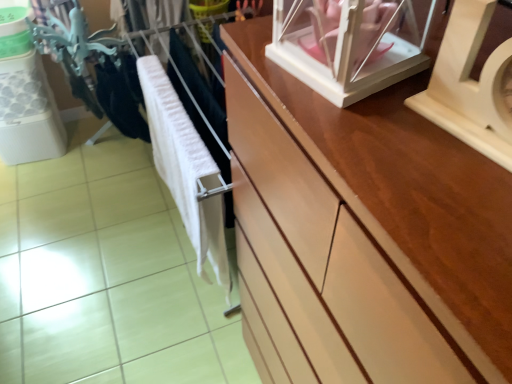
Question: Is white soft cloth at center oriented away from wooden clock at upper right?

Choices:
 (A) yes
 (B) no

Answer: (B)

Question: Considering the relative sizes of white soft cloth at center and wooden clock at upper right in the image provided, is white soft cloth at center wider than wooden clock at upper right?

Choices:
 (A) no
 (B) yes

Answer: (B)

Question: From a real-world perspective, does white soft cloth at center stand above wooden clock at upper right?

Choices:
 (A) no
 (B) yes

Answer: (A)

Question: Would you say white soft cloth at center is outside wooden clock at upper right?

Choices:
 (A) no
 (B) yes

Answer: (B)

Question: Is white soft cloth at center shorter than wooden clock at upper right?

Choices:
 (A) no
 (B) yes

Answer: (A)

Question: From the image's perspective, is white glossy glass box at upper right located above or below white soft cloth at center?

Choices:
 (A) above
 (B) below

Answer: (A)

Question: Is white glossy glass box at upper right situated inside white soft cloth at center or outside?

Choices:
 (A) inside
 (B) outside

Answer: (B)

Question: Is white glossy glass box at upper right wider or thinner than white soft cloth at center?

Choices:
 (A) thin
 (B) wide

Answer: (B)

Question: Based on their sizes in the image, would you say white glossy glass box at upper right is bigger or smaller than white soft cloth at center?

Choices:
 (A) small
 (B) big

Answer: (A)

Question: Considering the positions of white soft cloth at center and wooden clock at upper right in the image, is white soft cloth at center wider or thinner than wooden clock at upper right?

Choices:
 (A) wide
 (B) thin

Answer: (A)

Question: In the image, is white soft cloth at center on the left side or the right side of wooden clock at upper right?

Choices:
 (A) left
 (B) right

Answer: (A)

Question: In terms of height, does white soft cloth at center look taller or shorter compared to wooden clock at upper right?

Choices:
 (A) short
 (B) tall

Answer: (B)

Question: Considering their positions, is white soft cloth at center located in front of or behind wooden clock at upper right?

Choices:
 (A) behind
 (B) front

Answer: (A)

Question: From a real-world perspective, relative to white glossy glass box at upper right, is wooden clock at upper right vertically above or below?

Choices:
 (A) above
 (B) below

Answer: (B)

Question: Is point (501, 127) closer or farther from the camera than point (281, 26)?

Choices:
 (A) farther
 (B) closer

Answer: (B)